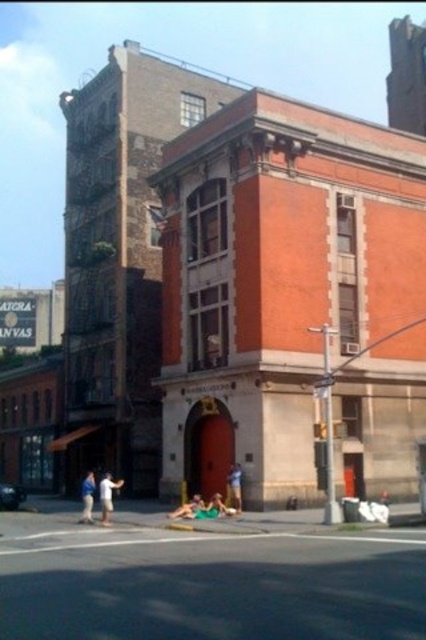
Question: Which object is farther from the camera taking this photo?

Choices:
 (A) green fabric at lower center
 (B) white cotton shirt at lower center
 (C) smooth skin person at lower center
 (D) blue denim shorts at lower center

Answer: (C)

Question: Which point appears closest to the camera in this image?

Choices:
 (A) (103, 490)
 (B) (232, 481)

Answer: (A)

Question: Can you confirm if white cotton shirt at lower center is smaller than smooth skin person at lower center?

Choices:
 (A) yes
 (B) no

Answer: (B)

Question: Which point is closer to the camera?

Choices:
 (A) green fabric person at lower center
 (B) smooth skin person at lower center
 (C) blue denim shorts at lower center
 (D) white cotton shirt at lower center

Answer: (D)

Question: Does blue denim shorts at lower center have a greater width compared to blue denim shorts at lower left?

Choices:
 (A) no
 (B) yes

Answer: (A)

Question: Does white cotton shirt at lower center lie behind blue denim shorts at lower left?

Choices:
 (A) no
 (B) yes

Answer: (A)